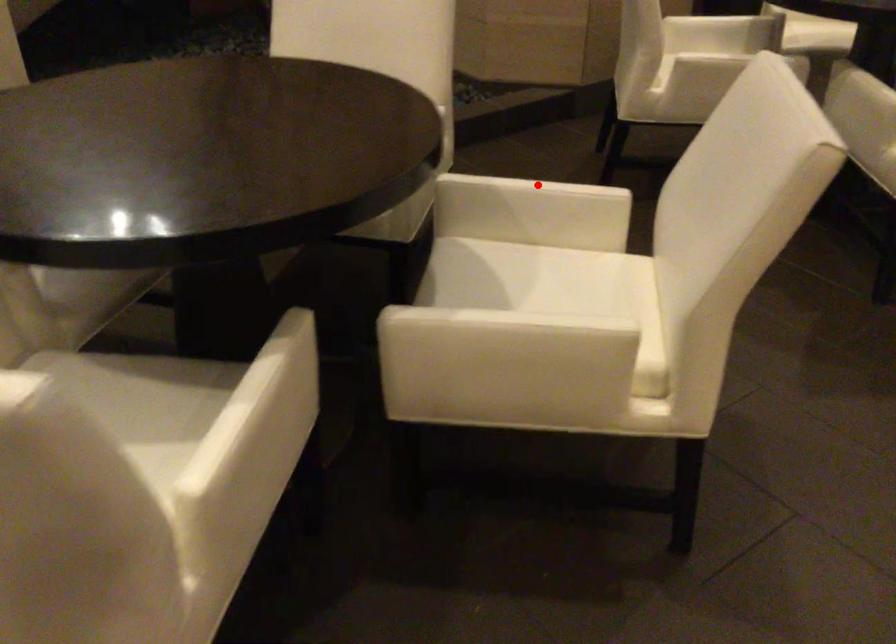
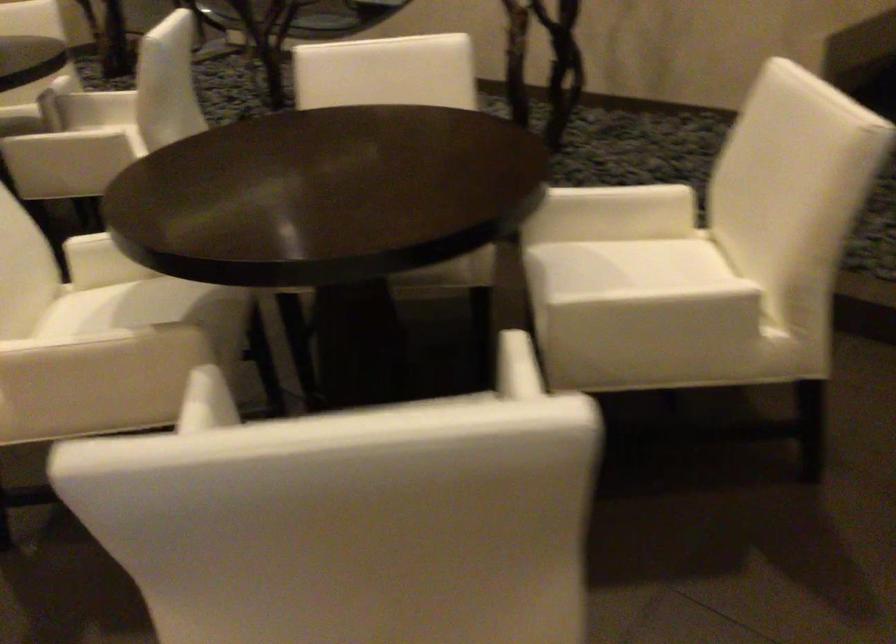
Question: I am providing you with two images of the same scene from different viewpoints. A red point is marked on the first image. Is the red point's position out of view in image 2?

Choices:
 (A) Yes
 (B) No

Answer: (A)